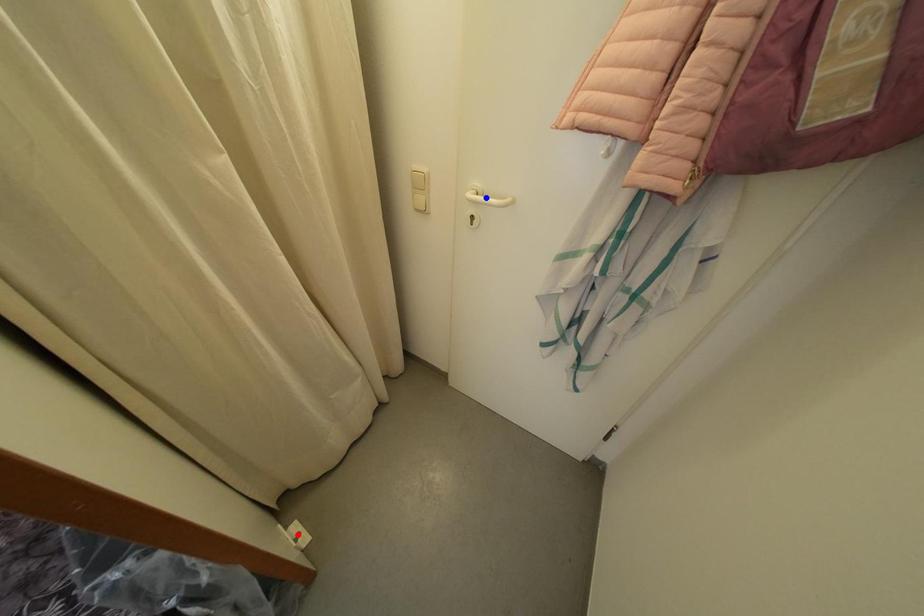
Question: Which of the two points in the image is closer to the camera?

Choices:
 (A) Blue point is closer.
 (B) Red point is closer.

Answer: (A)